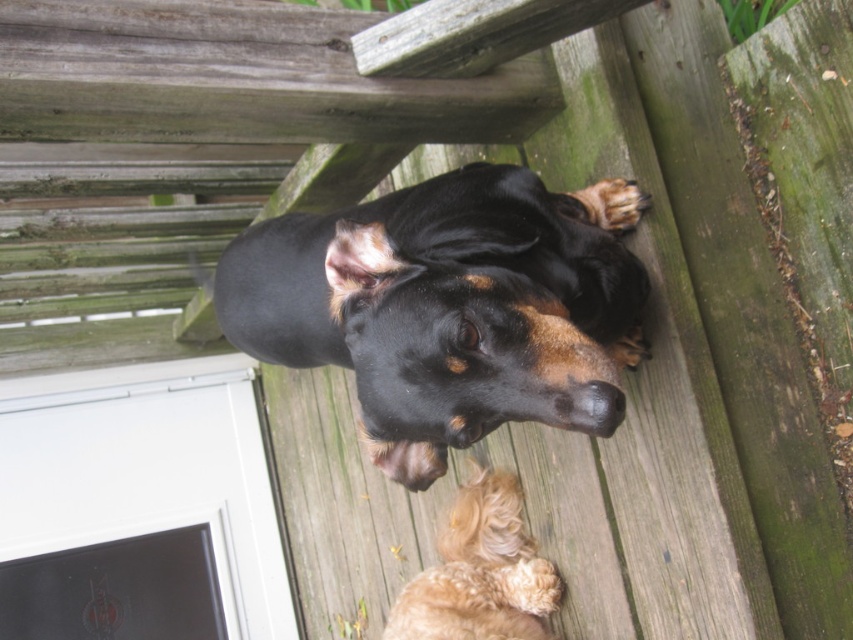
Is point (404, 416) behind point (498, 628)?

No.

Can you confirm if black shiny dog at upper center is shorter than golden fur dog at lower center?

No.

This screenshot has width=853, height=640. Identify the location of black shiny dog at upper center. coord(450,307).